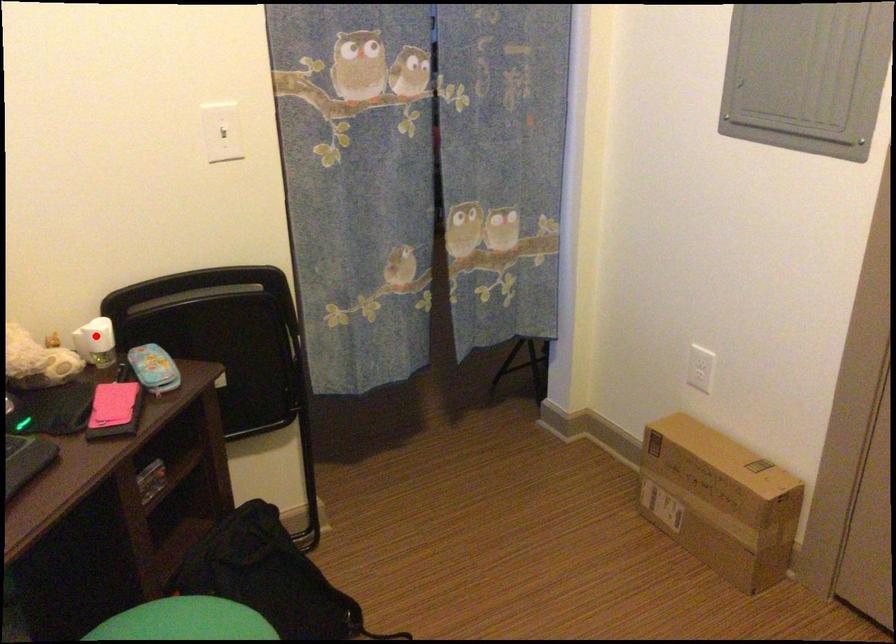
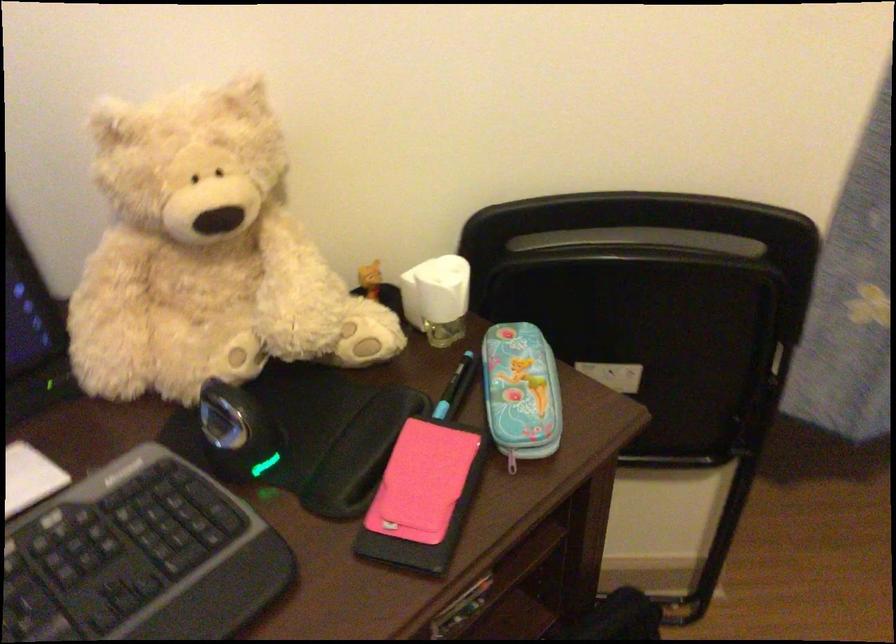
The point at the highlighted location is marked in the first image. Where is the corresponding point in the second image?

(437, 298)